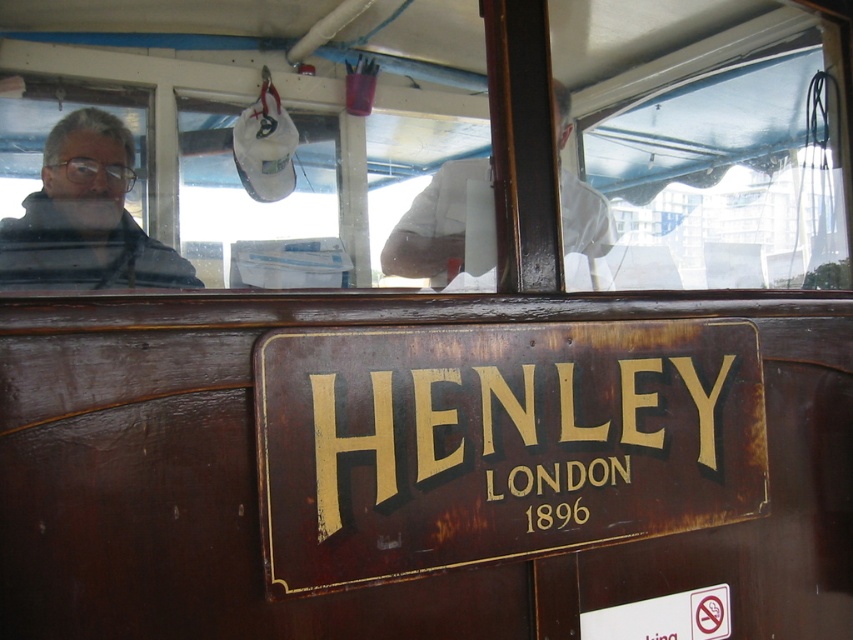
You are on a boat and want to see the view outside without the glare from the transparent glass window at center. You notice a white cloth at upper center. Can you use it to reduce the glare?

The transparent glass window at center is below the white cloth at upper center, so you can pull down the white cloth at upper center to cover the window and reduce the glare.

You are a tour guide on a boat. You need to hand out a brochure to a passenger wearing a gray matte jacket at left, who is standing 1.02 meters away from the rusty metal sign at center. Can you reach them without moving from your current position if your arm can extend 1.2 meters?

The rusty metal sign at center and gray matte jacket at left are 1.02 meters apart from each other. Since your arm can extend 1.2 meters, you can reach the passenger wearing the gray matte jacket at left without moving from your current position.